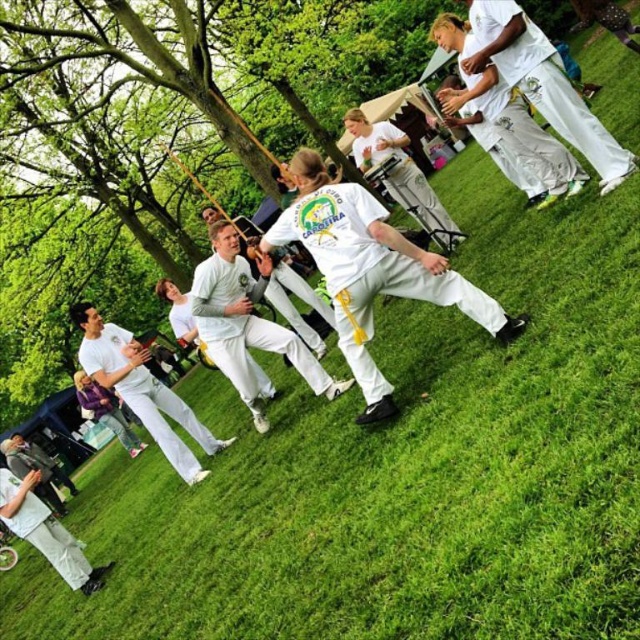
Is white matte pants at center to the left of white cotton pants at lower left from the viewer's perspective?

Incorrect, white matte pants at center is not on the left side of white cotton pants at lower left.

At what (x,y) coordinates should I click in order to perform the action: click on white matte pants at center. Please return your answer as a coordinate pair (x, y). Looking at the image, I should click on (371, 269).

Measure the distance between white matte uniform at center and camera.

The distance of white matte uniform at center from camera is 4.49 meters.

Identify the location of white matte uniform at center. (246, 321).

Is point (248, 275) behind point (483, 48)?

Yes.

Identify the location of white matte uniform at center. The image size is (640, 640). (246, 321).

Is point (211, 435) farther from camera compared to point (412, 186)?

Yes, it is behind point (412, 186).

Does white matte pants at lower left have a greater width compared to white cotton t-shirt at center?

Indeed, white matte pants at lower left has a greater width compared to white cotton t-shirt at center.

Who is more distant from viewer, (138, 368) or (404, 157)?

Point (404, 157)

Where is `white matte pants at lower left`? white matte pants at lower left is located at coordinates (141, 388).